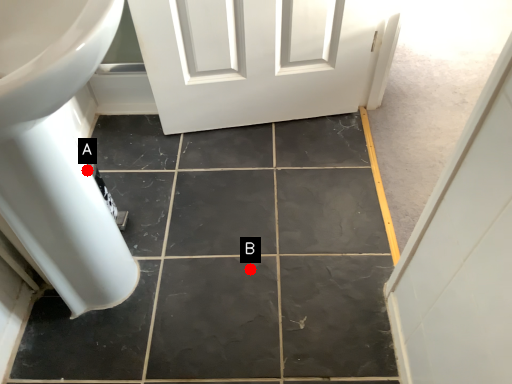
Question: Two points are circled on the image, labeled by A and B beside each circle. Among these points, which one is farthest from the camera?

Choices:
 (A) A is further
 (B) B is further

Answer: (B)